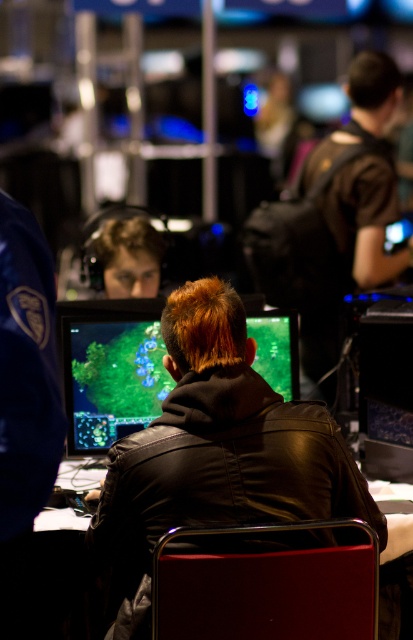
Question: Is black leather jacket at center below metallic red chair at center?

Choices:
 (A) no
 (B) yes

Answer: (A)

Question: Is matte black monitor at center to the left of metallic table at center from the viewer's perspective?

Choices:
 (A) no
 (B) yes

Answer: (A)

Question: Which object is closer to the camera taking this photo?

Choices:
 (A) matte black monitor at center
 (B) metallic table at center
 (C) metallic red chair at center
 (D) black leather jacket at center

Answer: (C)

Question: Among these objects, which one is farthest from the camera?

Choices:
 (A) matte black monitor at center
 (B) metallic table at center
 (C) black leather jacket at center
 (D) metallic red chair at center

Answer: (A)

Question: Is black leather jacket at center smaller than matte black monitor at center?

Choices:
 (A) yes
 (B) no

Answer: (B)

Question: Which of these objects is positioned farthest from the metallic table at center?

Choices:
 (A) metallic red chair at center
 (B) black leather jacket at center
 (C) matte black monitor at center

Answer: (A)